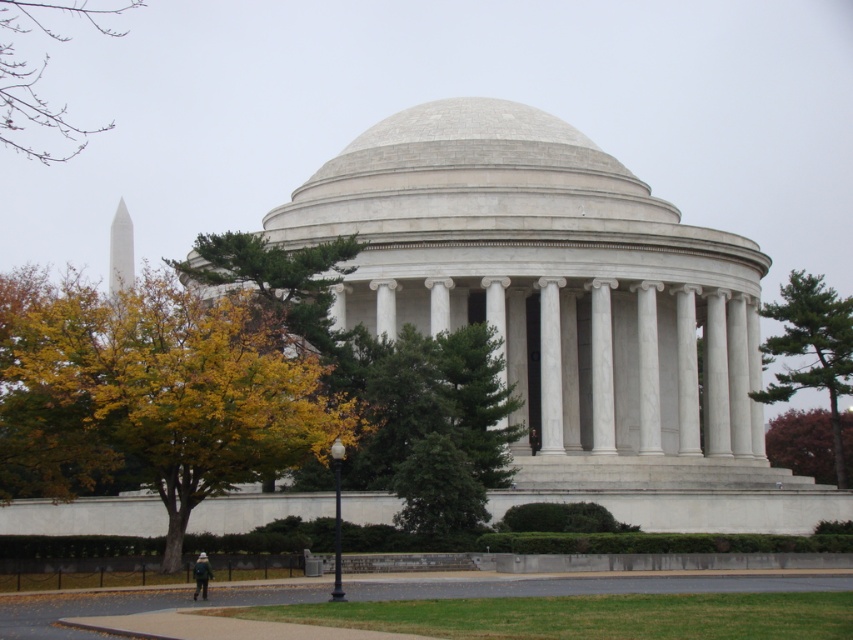
Question: Which point is farther to the camera?

Choices:
 (A) reddish-brown bark tree at lower right
 (B) green leafy tree at right
 (C) green leafy tree at upper left

Answer: (C)

Question: Which of the following is the farthest from the observer?

Choices:
 (A) reddish-brown bark tree at lower right
 (B) green leafy tree at upper left

Answer: (B)

Question: Based on their relative distances, which object is farther from the white marble pillar at center?

Choices:
 (A) green leafy tree at upper left
 (B) yellow-green leaves at left
 (C) green leafy tree at right
 (D) reddish-brown bark tree at lower right

Answer: (A)

Question: From the image, what is the correct spatial relationship of yellow-green leaves at left in relation to green leafy tree at upper left?

Choices:
 (A) right
 (B) left

Answer: (A)

Question: Is green leafy tree at right closer to camera compared to green leafy tree at upper left?

Choices:
 (A) no
 (B) yes

Answer: (B)

Question: Is green leafy tree at right wider than green leafy tree at upper left?

Choices:
 (A) no
 (B) yes

Answer: (B)